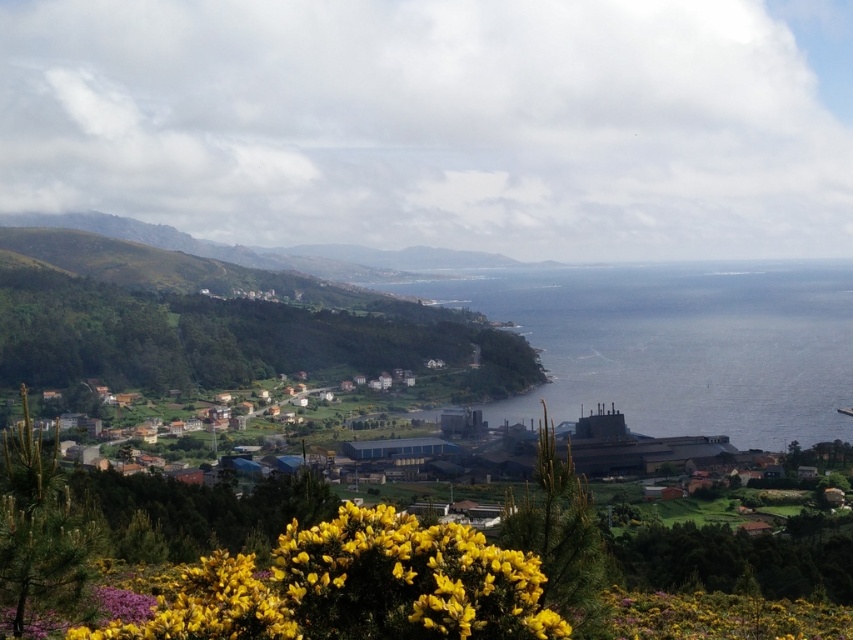
Is blue water at center above yellow matte flower at lower center?

Yes.

Based on the photo, between blue water at center and yellow matte flower at lower center, which one is positioned higher?

blue water at center is above.

This screenshot has height=640, width=853. I want to click on blue water at center, so click(x=679, y=344).